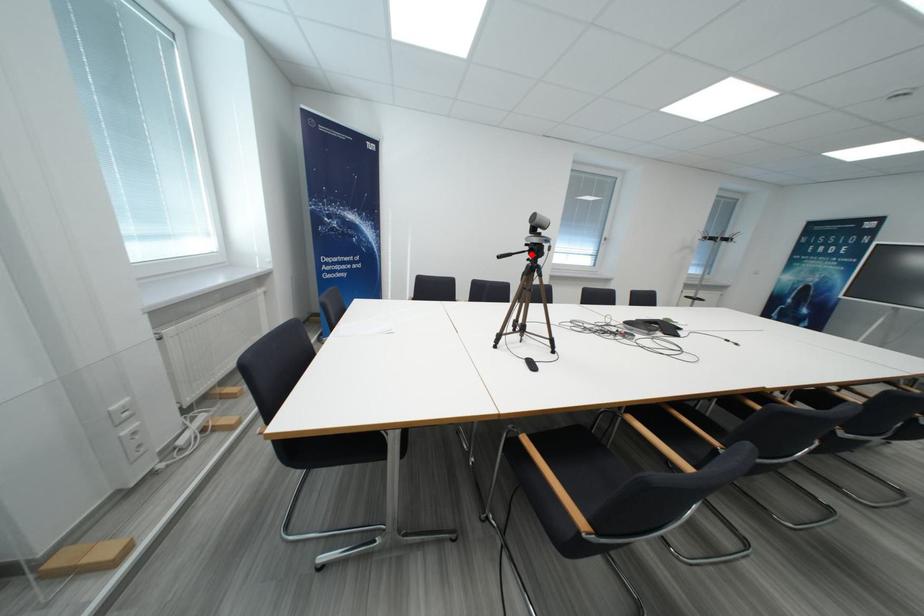
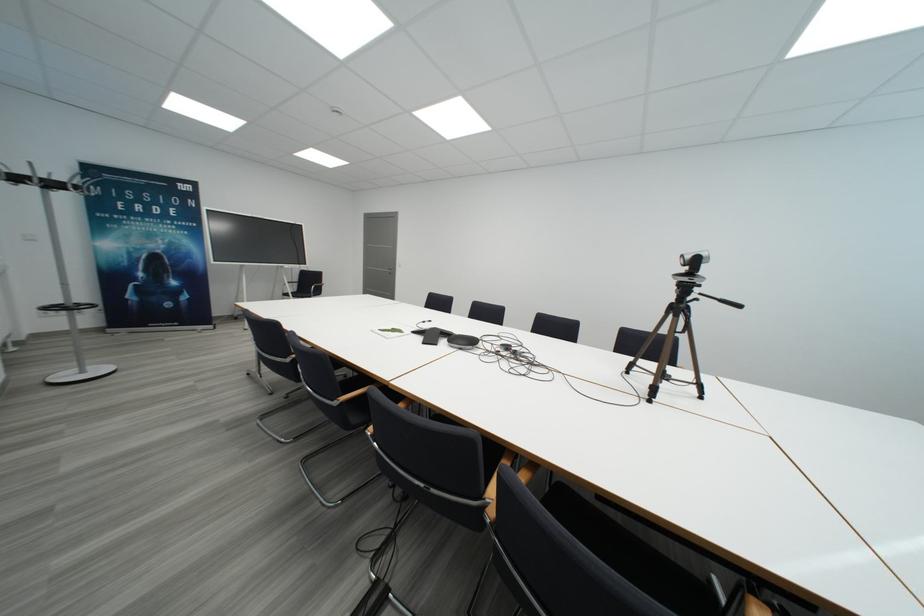
Find the pixel in the second image that matches the highlighted location in the first image.

(708, 297)